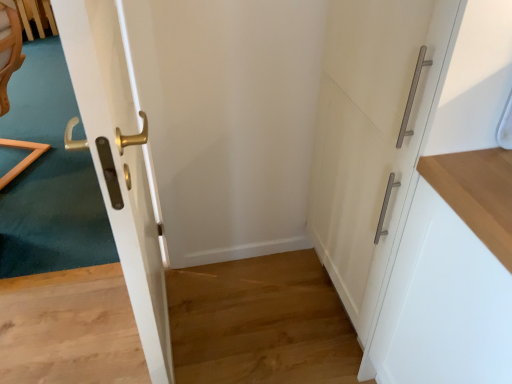
Question: Does white matte cabinet at right contain white matte cabinet handle at right, which appears as the 1th door when viewed from the right?

Choices:
 (A) yes
 (B) no

Answer: (B)

Question: Is there a large distance between white matte cabinet at right and white matte cabinet handle at right, the second door in the left-to-right sequence?

Choices:
 (A) yes
 (B) no

Answer: (B)

Question: Is white matte cabinet at right taller than white matte cabinet handle at right, the second door in the left-to-right sequence?

Choices:
 (A) yes
 (B) no

Answer: (B)

Question: From the image's perspective, is white matte cabinet at right on white matte cabinet handle at right, the second door in the left-to-right sequence?

Choices:
 (A) no
 (B) yes

Answer: (A)

Question: Considering the relative positions of white matte cabinet at right and white matte cabinet handle at right, the second door in the left-to-right sequence, in the image provided, is white matte cabinet at right to the right of white matte cabinet handle at right, the second door in the left-to-right sequence, from the viewer's perspective?

Choices:
 (A) yes
 (B) no

Answer: (A)

Question: Does white matte cabinet at right turn towards white matte cabinet handle at right, which appears as the 1th door when viewed from the right?

Choices:
 (A) no
 (B) yes

Answer: (A)

Question: Can you confirm if glossy white door at left, which is the second door from right to left, is positioned to the right of white matte cabinet at right?

Choices:
 (A) no
 (B) yes

Answer: (A)

Question: Considering the relative positions of glossy white door at left, which is the second door from right to left, and white matte cabinet at right in the image provided, is glossy white door at left, which is the second door from right to left, behind white matte cabinet at right?

Choices:
 (A) no
 (B) yes

Answer: (A)

Question: Is white matte cabinet at right at the back of glossy white door at left, marked as the first door in a left-to-right arrangement?

Choices:
 (A) no
 (B) yes

Answer: (B)

Question: Is glossy white door at left, marked as the first door in a left-to-right arrangement, bigger than white matte cabinet at right?

Choices:
 (A) yes
 (B) no

Answer: (B)

Question: Can you confirm if glossy white door at left, which is the second door from right to left, is taller than white matte cabinet at right?

Choices:
 (A) yes
 (B) no

Answer: (A)

Question: Is glossy white door at left, which is the second door from right to left, aimed at white matte cabinet at right?

Choices:
 (A) yes
 (B) no

Answer: (B)

Question: Is white matte cabinet handle at right, which appears as the 1th door when viewed from the right, smaller than white matte cabinet at right?

Choices:
 (A) yes
 (B) no

Answer: (B)